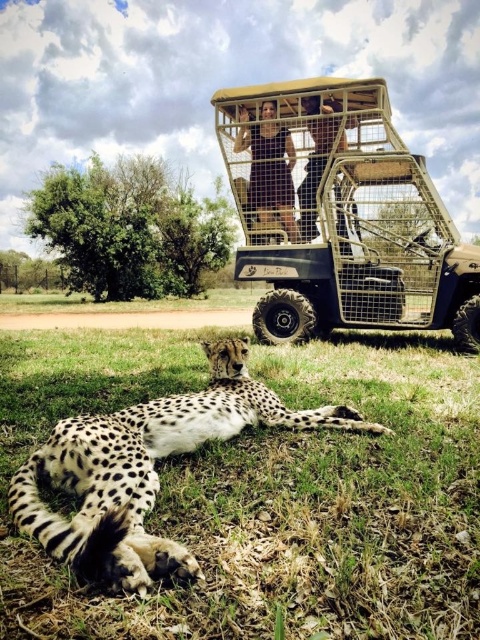
You are a wildlife photographer planning to take a photo of the spotted fur cheetah at lower left and the dark brown fabric pants at center. Based on their sizes, which one should you focus on first to ensure they both fit in the frame?

The spotted fur cheetah at lower left is bigger than the dark brown fabric pants at center, so you should focus on the spotted fur cheetah at lower left first to ensure both fit in the frame.

You are a photographer standing in the savanna. You see the dark brown fabric pants at center and the smooth skin person at center. Which one is taller?

The dark brown fabric pants at center is taller than the smooth skin person at center.

You are a photographer standing at the camera position. You want to take a photo of the spotted fur cheetah at lower left without any obstructions. The safari vehicle behind it is 3 meters away from the cheetah. Is there enough space between the cheetah and the safari vehicle for you to capture the cheetah clearly?

The spotted fur cheetah at lower left is 1.65 meters from the camera, while the safari vehicle is 3 meters away from the cheetah. This means the total distance from the camera to the safari vehicle is 4.65 meters. Since the safari vehicle is behind the cheetah, there is a 3 meter gap between them, which should provide enough space for the photographer to capture the cheetah without obstruction.